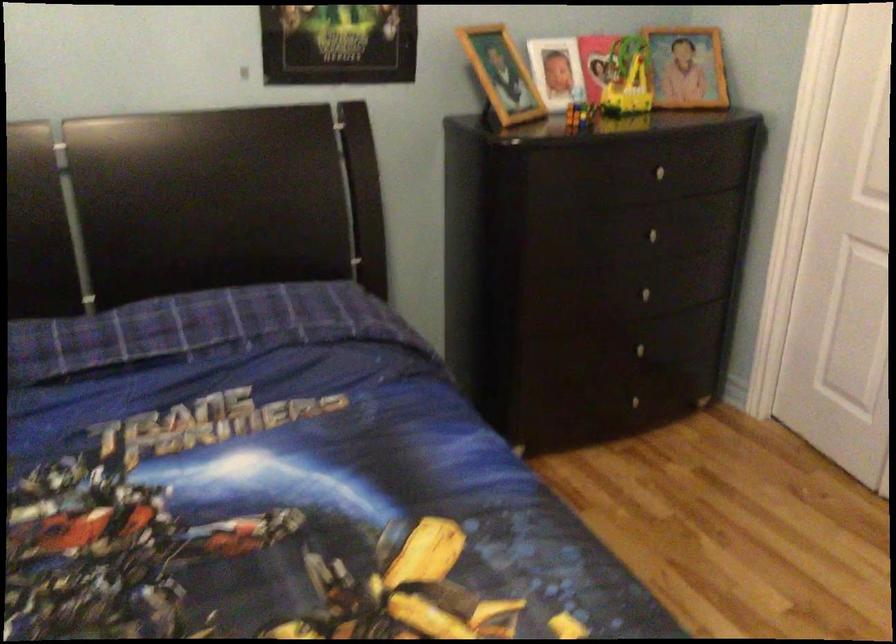
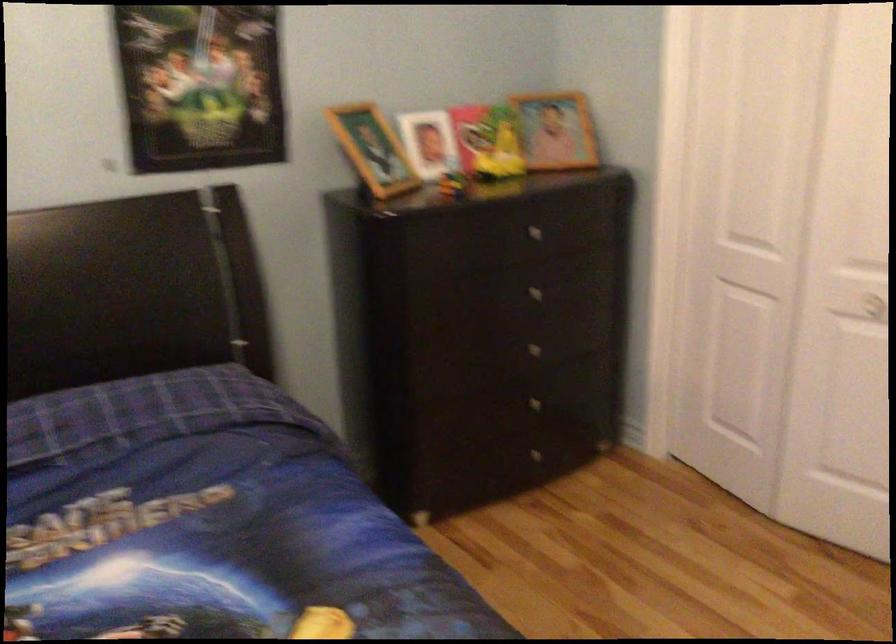
The point at (650, 298) is marked in the first image. Where is the corresponding point in the second image?

(539, 353)